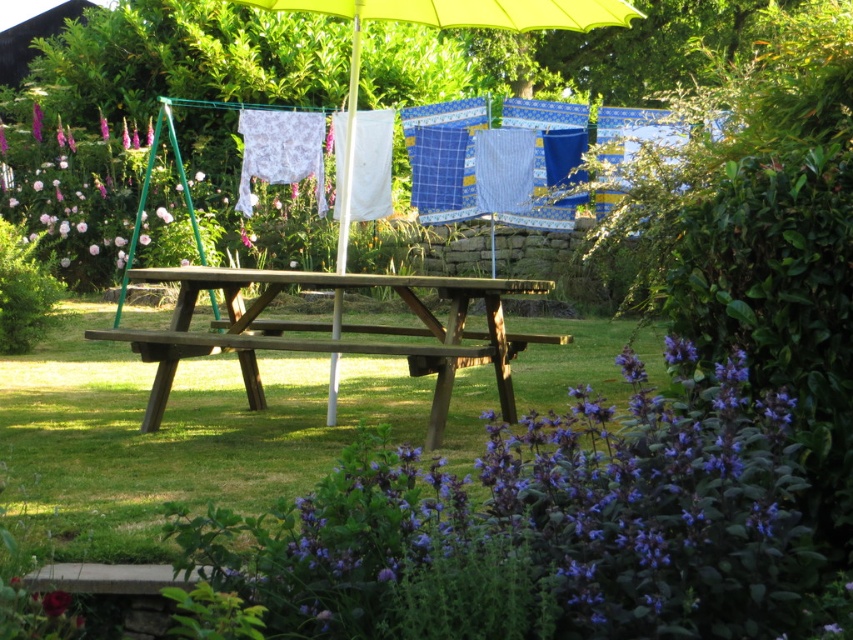
You are planning to place a small statue between the purple leafy plant at lower center and the purple matte flower at lower left. Which object should the statue be closer to if it needs to be placed at the same height as the shorter one?

The purple matte flower at lower left is shorter than the purple leafy plant at lower center. Therefore, the statue should be placed closer to the purple matte flower at lower left to match its height.

You are planning to have a picnic and want to set up your basket on the wooden picnic table at center. However, you notice the purple matte flower at lower left. Can you place the basket directly in front of the flower without moving the table?

The wooden picnic table at center is in front of the purple matte flower at lower left, so placing the basket directly in front of the flower would require placing it behind the picnic table, which might not be possible without moving the table.